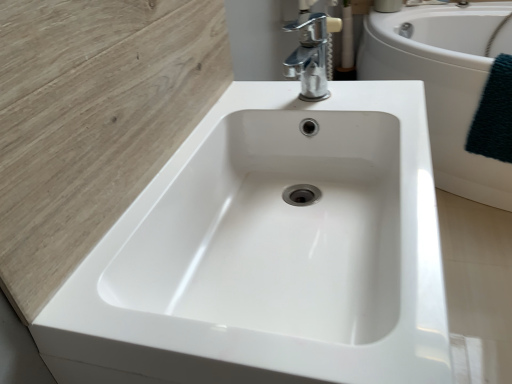
Question: From a real-world perspective, is white glossy bathtub at center above or below dark green textured towel at right?

Choices:
 (A) above
 (B) below

Answer: (B)

Question: In terms of height, does white glossy bathtub at center look taller or shorter compared to dark green textured towel at right?

Choices:
 (A) tall
 (B) short

Answer: (A)

Question: Which object is the farthest from the chrome metallic faucet at upper center?

Choices:
 (A) dark green textured towel at right
 (B) white glossy bathtub at center
 (C) white glossy sink at center

Answer: (B)

Question: Which of these objects is positioned closest to the white glossy bathtub at center?

Choices:
 (A) dark green textured towel at right
 (B) white glossy sink at center
 (C) chrome metallic faucet at upper center

Answer: (A)